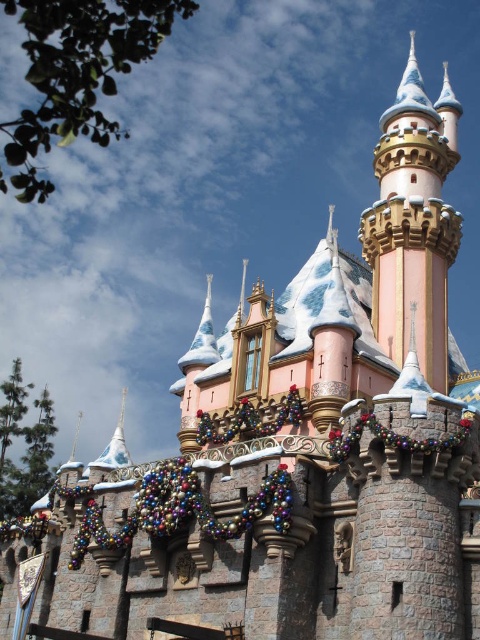
Is pink stone castle tower at upper right bigger than metallic garland at center?

Indeed, pink stone castle tower at upper right has a larger size compared to metallic garland at center.

Is pink stone castle tower at upper right above metallic garland at center?

Yes, pink stone castle tower at upper right is above metallic garland at center.

Who is more forward, (411, 282) or (282, 419)?

Point (282, 419) is more forward.

The image size is (480, 640). Identify the location of pink stone castle tower at upper right. (414, 221).

Is the position of multicolored glass garland at lower center more distant than that of metallic garland at center?

No, it is not.

Can you confirm if multicolored glass garland at lower center is taller than metallic garland at center?

Indeed, multicolored glass garland at lower center has a greater height compared to metallic garland at center.

Find the location of `multicolored glass garland at lower center`. multicolored glass garland at lower center is located at coordinates (181, 509).

Which of these two, pink stone castle tower at upper right or multicolored glass garland at lower center, stands shorter?

multicolored glass garland at lower center

Which is below, pink stone castle tower at upper right or multicolored glass garland at lower center?

multicolored glass garland at lower center is below.

Does point (373, 221) come behind point (262, 515)?

Yes, point (373, 221) is behind point (262, 515).

Find the location of a particular element. The height and width of the screenshot is (640, 480). pink stone castle tower at upper right is located at coordinates (414, 221).